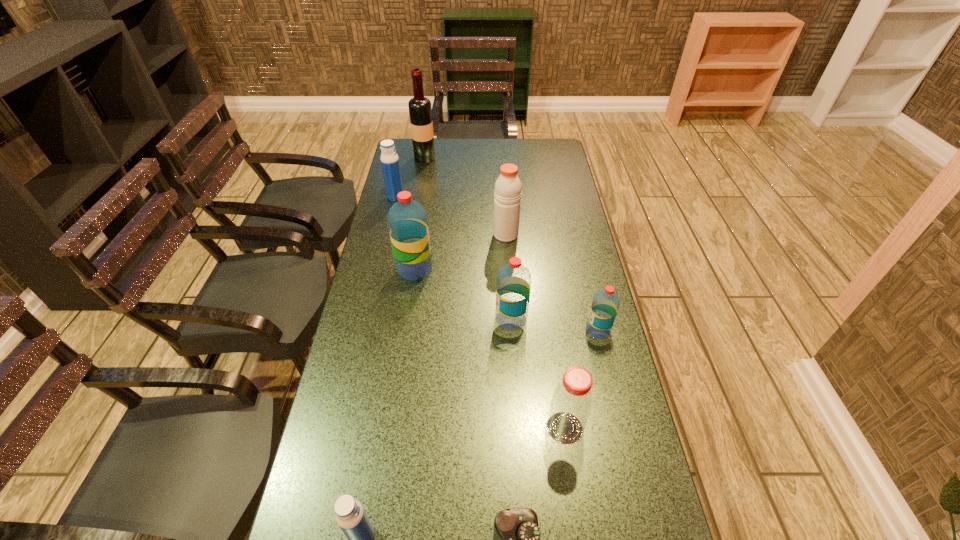
The image size is (960, 540). What are the coordinates of `vacant space positioned 0.180m on the front label of the fourth water bottle from left to right` in the screenshot? It's located at (436, 319).

The height and width of the screenshot is (540, 960). I want to click on free space located 0.100m on the right of the red bottle, so click(624, 428).

Identify the location of blank space located on the front label of the rightmost water bottle. (531, 330).

What are the coordinates of `free region located 0.220m on the front label of the rightmost water bottle` in the screenshot? It's located at (511, 330).

Find the location of `vacant space located 0.400m on the front label of the rightmost water bottle`. vacant space located 0.400m on the front label of the rightmost water bottle is located at coordinates (449, 330).

The width and height of the screenshot is (960, 540). I want to click on object located in the far edge section of the desktop, so click(x=420, y=112).

Where is `wine bottle that is at the left edge`? The width and height of the screenshot is (960, 540). wine bottle that is at the left edge is located at coordinates (420, 112).

Image resolution: width=960 pixels, height=540 pixels. Identify the location of bottle that is at the right edge. (571, 403).

Image resolution: width=960 pixels, height=540 pixels. Find the location of `water bottle that is at the right edge`. water bottle that is at the right edge is located at coordinates (605, 304).

You are a GUI agent. You are given a task and a screenshot of the screen. Output one action in this format:
    pyautogui.click(x=<x>, y=<y>)
    Task: Click on the object that is at the far left corner
    The height and width of the screenshot is (540, 960).
    Given the screenshot: What is the action you would take?
    pyautogui.click(x=420, y=112)